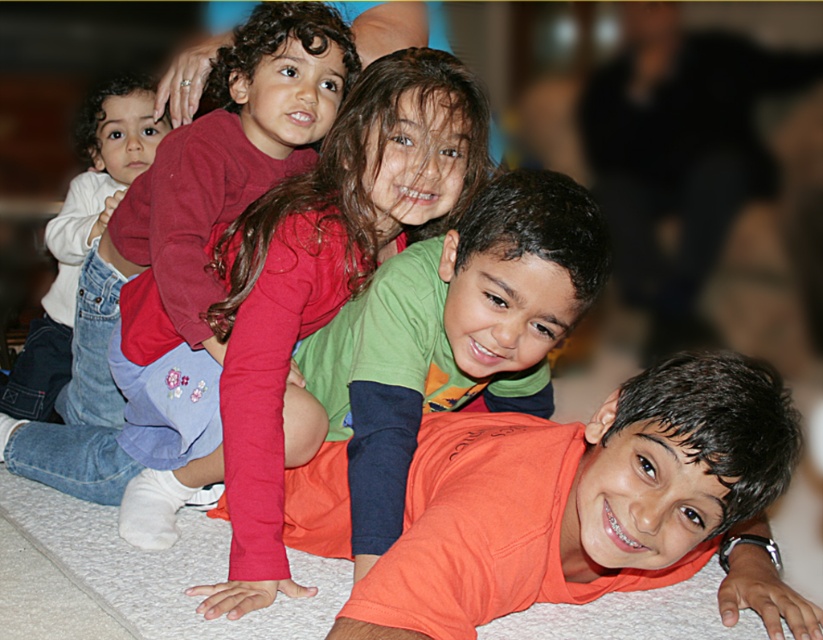
Is point (724, 528) behind point (122, 116)?

No, (724, 528) is in front of (122, 116).

Is orange cotton shirt at lower right shorter than white denim jeans at left?

Indeed, orange cotton shirt at lower right has a lesser height compared to white denim jeans at left.

Between point (689, 474) and point (129, 145), which one is positioned behind?

Point (129, 145)

Identify the location of orange cotton shirt at lower right. Image resolution: width=823 pixels, height=640 pixels. [x=673, y=465].

Which is more to the right, orange cotton shirt at center or white denim jeans at left?

orange cotton shirt at center is more to the right.

At what (x,y) coordinates should I click in order to perform the action: click on orange cotton shirt at center. Please return your answer as a coordinate pair (x, y). This screenshot has width=823, height=640. Looking at the image, I should click on (454, 332).

Image resolution: width=823 pixels, height=640 pixels. Identify the location of orange cotton shirt at center. [454, 332].

Can you confirm if matte red shirt at upper left is smaller than white denim jeans at left?

Correct, matte red shirt at upper left occupies less space than white denim jeans at left.

The height and width of the screenshot is (640, 823). What are the coordinates of `matte red shirt at upper left` in the screenshot? It's located at (280, 92).